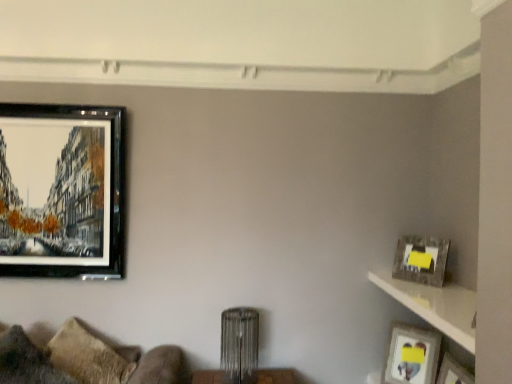
Question: Is point pos(147,374) closer or farther from the camera than point pos(404,375)?

Choices:
 (A) farther
 (B) closer

Answer: (B)

Question: From a real-world perspective, is velvet beige couch at lower left above or below matte silver picture frame at right, the 2th picture frame from the left?

Choices:
 (A) above
 (B) below

Answer: (A)

Question: Based on their relative distances, which object is nearer to the textured brown pillow at lower left?

Choices:
 (A) matte black picture frame at upper left, placed as the 3th picture frame when sorted from bottom to top
 (B) matte gray picture frame at upper right, which ranks as the second picture frame in top-to-bottom order
 (C) velvet beige couch at lower left
 (D) matte silver picture frame at right, marked as the 2th picture frame in a right-to-left arrangement
 (E) matte gray shelf at right

Answer: (C)

Question: Estimate the real-world distances between objects in this image. Which object is closer to the matte silver picture frame at right, marked as the 2th picture frame in a right-to-left arrangement?

Choices:
 (A) matte gray picture frame at upper right, placed as the 2th picture frame when sorted from bottom to top
 (B) textured brown pillow at lower left
 (C) matte black picture frame at upper left, acting as the 3th picture frame starting from the right
 (D) matte gray shelf at right
 (E) velvet beige couch at lower left

Answer: (A)